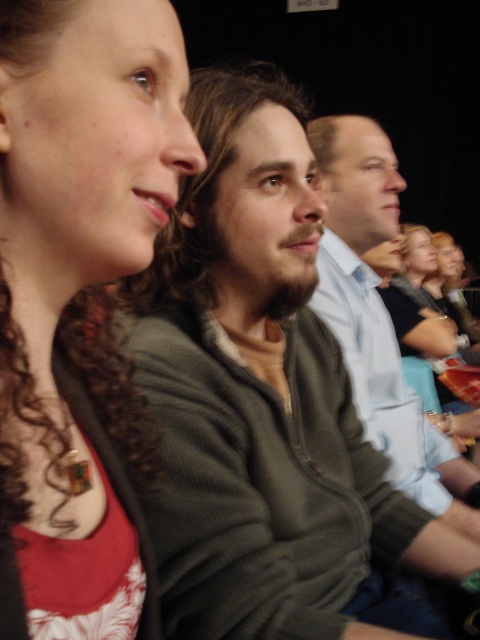
Can you confirm if dark green sweater at center is thinner than matte green sweater at upper left?

No, dark green sweater at center is not thinner than matte green sweater at upper left.

What do you see at coordinates (264, 401) in the screenshot? I see `dark green sweater at center` at bounding box center [264, 401].

You are a GUI agent. You are given a task and a screenshot of the screen. Output one action in this format:
    pyautogui.click(x=<x>, y=<y>)
    Task: Click on the dark green sweater at center
    Image resolution: width=480 pixels, height=640 pixels.
    Given the screenshot: What is the action you would take?
    pyautogui.click(x=264, y=401)

Who is positioned more to the left, matte green sweater at upper left or light blue shirt at center?

Positioned to the left is matte green sweater at upper left.

Is point (178, 170) positioned after point (396, 442)?

No, it is not.

At what (x,y) coordinates should I click in order to perform the action: click on matte green sweater at upper left. Please return your answer as a coordinate pair (x, y). Image resolution: width=480 pixels, height=640 pixels. Looking at the image, I should click on (80, 301).

Who is more forward, (264,435) or (398,381)?

Point (264,435) is in front.

Is point (162, 493) less distant than point (348, 275)?

Yes, point (162, 493) is in front of point (348, 275).

I want to click on dark green sweater at center, so click(264, 401).